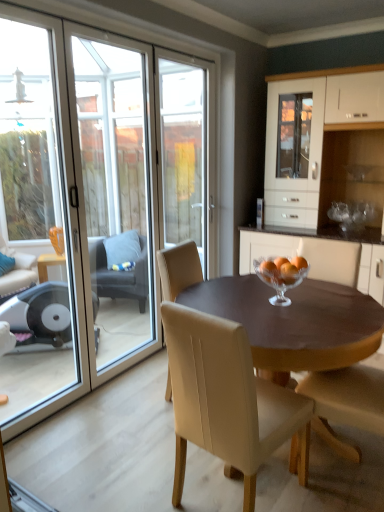
Question: Is transparent glass screen door at left oriented towards beige leather chair at center, positioned as the 3th chair in front-to-back order?

Choices:
 (A) no
 (B) yes

Answer: (B)

Question: From the image's perspective, is transparent glass screen door at left below beige leather chair at center, which is the 2th chair in back-to-front order?

Choices:
 (A) yes
 (B) no

Answer: (B)

Question: Is the position of transparent glass screen door at left more distant than that of beige leather chair at center, positioned as the 3th chair in front-to-back order?

Choices:
 (A) yes
 (B) no

Answer: (A)

Question: Is transparent glass screen door at left to the left of beige leather chair at center, which is the 2th chair in back-to-front order, from the viewer's perspective?

Choices:
 (A) yes
 (B) no

Answer: (A)

Question: Considering the relative sizes of transparent glass screen door at left and beige leather chair at center, positioned as the 3th chair in front-to-back order, in the image provided, is transparent glass screen door at left bigger than beige leather chair at center, positioned as the 3th chair in front-to-back order,?

Choices:
 (A) yes
 (B) no

Answer: (B)

Question: Is beige leather chair at center, positioned as the 3th chair in front-to-back order, taller or shorter than transparent glass door at left?

Choices:
 (A) tall
 (B) short

Answer: (B)

Question: From a real-world perspective, is beige leather chair at center, positioned as the 3th chair in front-to-back order, positioned above or below transparent glass door at left?

Choices:
 (A) above
 (B) below

Answer: (B)

Question: From the image's perspective, relative to transparent glass door at left, is beige leather chair at center, the third chair when ordered from right to left, above or below?

Choices:
 (A) below
 (B) above

Answer: (A)

Question: Is point (180, 269) closer or farther from the camera than point (142, 181)?

Choices:
 (A) farther
 (B) closer

Answer: (B)

Question: From a real-world perspective, is beige leather chair at center, which ranks as the 2th chair in right-to-left order, positioned above or below white glossy cabinet at center?

Choices:
 (A) below
 (B) above

Answer: (A)

Question: Does point (175, 430) appear closer or farther from the camera than point (370, 115)?

Choices:
 (A) farther
 (B) closer

Answer: (B)

Question: Considering the positions of beige leather chair at center, arranged as the 3th chair when viewed from the left, and white glossy cabinet at center in the image, is beige leather chair at center, arranged as the 3th chair when viewed from the left, wider or thinner than white glossy cabinet at center?

Choices:
 (A) thin
 (B) wide

Answer: (A)

Question: Visually, is beige leather chair at center, the first chair positioned from the front, positioned to the left or to the right of white glossy cabinet at center?

Choices:
 (A) right
 (B) left

Answer: (B)

Question: From the image's perspective, relative to white glossy cabinet at center, is beige leather chair at center, which is counted as the 2th chair, starting from the left, above or below?

Choices:
 (A) below
 (B) above

Answer: (A)

Question: From a real-world perspective, relative to white glossy cabinet at center, is beige leather chair at center, which is counted as the 2th chair, starting from the left, vertically above or below?

Choices:
 (A) above
 (B) below

Answer: (B)